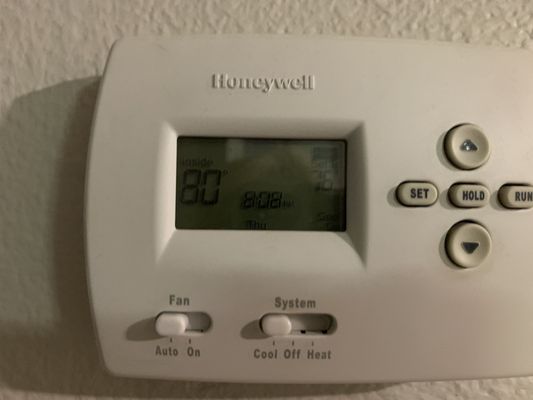
You are a GUI agent. You are given a task and a screenshot of the screen. Output one action in this format:
    pyautogui.click(x=<x>, y=<y>)
    Task: Click on the wall
    This screenshot has height=400, width=533.
    Given the screenshot: What is the action you would take?
    pyautogui.click(x=25, y=163)